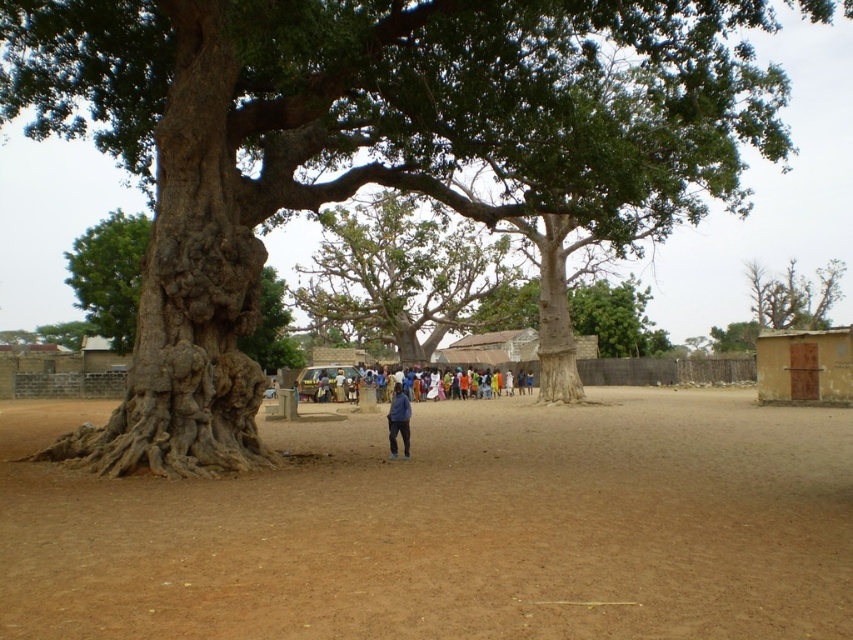
Can you confirm if gray rough bark tree at left is positioned to the left of multicolored fabric people at center?

Correct, you'll find gray rough bark tree at left to the left of multicolored fabric people at center.

Does gray rough bark tree at left have a lesser width compared to multicolored fabric people at center?

Correct, gray rough bark tree at left's width is less than multicolored fabric people at center's.

Is point (276, 292) positioned after point (299, 378)?

Yes, it is behind point (299, 378).

Where is `gray rough bark tree at left`? gray rough bark tree at left is located at coordinates (271, 326).

Does green rough bark tree at upper left appear on the right side of gray rough bark tree at left?

Incorrect, green rough bark tree at upper left is not on the right side of gray rough bark tree at left.

Can you confirm if green rough bark tree at upper left is positioned above gray rough bark tree at left?

Indeed, green rough bark tree at upper left is positioned over gray rough bark tree at left.

You are a GUI agent. You are given a task and a screenshot of the screen. Output one action in this format:
    pyautogui.click(x=<x>, y=<y>)
    Task: Click on the green rough bark tree at upper left
    The image size is (853, 640).
    Given the screenshot: What is the action you would take?
    pyautogui.click(x=109, y=275)

Is gray rough bark tree at left to the right of blue fabric jacket at center from the viewer's perspective?

No, gray rough bark tree at left is not to the right of blue fabric jacket at center.

Is point (277, 304) positioned in front of point (389, 458)?

No.

Does point (277, 348) come behind point (392, 397)?

Yes, it is.

Identify the location of gray rough bark tree at left. (271, 326).